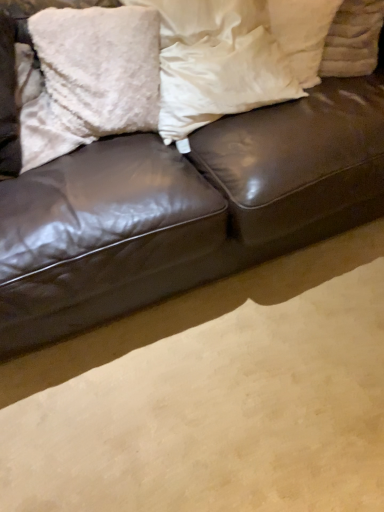
Question: Is white soft pillow at center, the second pillow in the right-to-left sequence, at the back of fluffy white pillow at upper left, arranged as the first pillow when viewed from the left?

Choices:
 (A) no
 (B) yes

Answer: (A)

Question: Are fluffy white pillow at upper left, which ranks as the 3th pillow in right-to-left order, and white soft pillow at center, the 2th pillow viewed from the left, making contact?

Choices:
 (A) no
 (B) yes

Answer: (A)

Question: Considering the relative sizes of fluffy white pillow at upper left, which ranks as the 3th pillow in right-to-left order, and white soft pillow at center, the second pillow in the right-to-left sequence, in the image provided, is fluffy white pillow at upper left, which ranks as the 3th pillow in right-to-left order, thinner than white soft pillow at center, the second pillow in the right-to-left sequence,?

Choices:
 (A) no
 (B) yes

Answer: (B)

Question: Can you confirm if fluffy white pillow at upper left, arranged as the first pillow when viewed from the left, is shorter than white soft pillow at center, the second pillow in the right-to-left sequence?

Choices:
 (A) no
 (B) yes

Answer: (B)

Question: Is fluffy white pillow at upper left, arranged as the first pillow when viewed from the left, smaller than white soft pillow at center, the 2th pillow viewed from the left?

Choices:
 (A) yes
 (B) no

Answer: (A)

Question: Can you confirm if fluffy white pillow at upper left, which ranks as the 3th pillow in right-to-left order, is bigger than white soft pillow at center, the 2th pillow viewed from the left?

Choices:
 (A) yes
 (B) no

Answer: (B)

Question: From the image's perspective, is shiny brown leather couch at center on white fluffy pillow at upper right, positioned as the 3th pillow in left-to-right order?

Choices:
 (A) yes
 (B) no

Answer: (B)

Question: Is shiny brown leather couch at center far away from white fluffy pillow at upper right, which is the 1th pillow in right-to-left order?

Choices:
 (A) yes
 (B) no

Answer: (B)

Question: From the image's perspective, is shiny brown leather couch at center under white fluffy pillow at upper right, which is the 1th pillow in right-to-left order?

Choices:
 (A) yes
 (B) no

Answer: (A)

Question: Is shiny brown leather couch at center directly adjacent to white fluffy pillow at upper right, which is the 1th pillow in right-to-left order?

Choices:
 (A) yes
 (B) no

Answer: (B)

Question: Is shiny brown leather couch at center smaller than white fluffy pillow at upper right, which is the 1th pillow in right-to-left order?

Choices:
 (A) no
 (B) yes

Answer: (A)

Question: Is shiny brown leather couch at center to the right of white fluffy pillow at upper right, which is the 1th pillow in right-to-left order, from the viewer's perspective?

Choices:
 (A) no
 (B) yes

Answer: (A)

Question: Is white fluffy pillow at upper right, which is the 1th pillow in right-to-left order, completely or partially outside of white soft pillow at center, the second pillow in the right-to-left sequence?

Choices:
 (A) no
 (B) yes

Answer: (B)